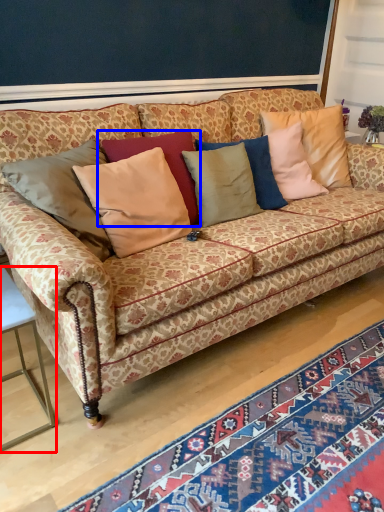
Question: Which of the following is the farthest to the observer, table (highlighted by a red box) or pillow (highlighted by a blue box)?

Choices:
 (A) table
 (B) pillow

Answer: (B)